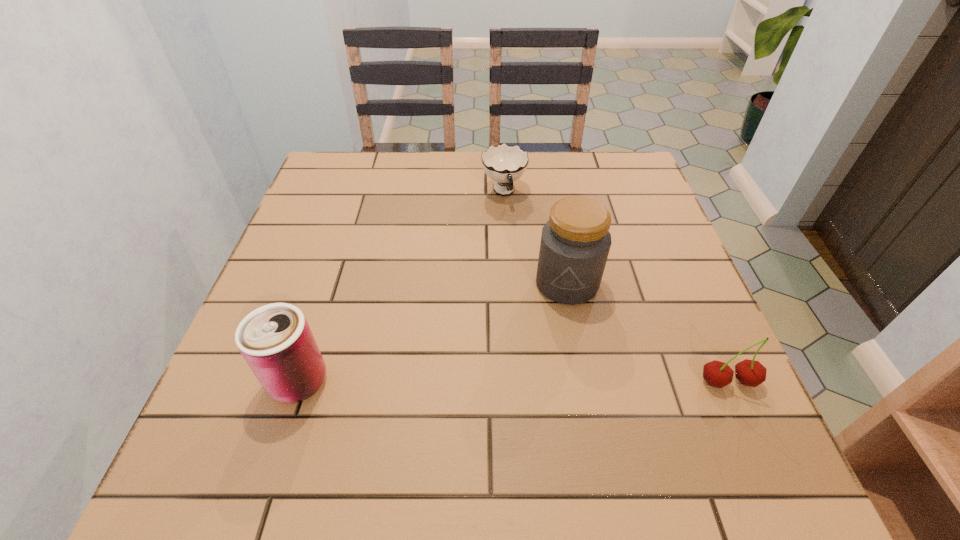
The width and height of the screenshot is (960, 540). Identify the location of free space located 0.060m on the surface of the jar near the warning symbol. (553, 327).

Locate an element on the screen. The width and height of the screenshot is (960, 540). vacant region located 0.190m on the surface of the jar near the warning symbol is located at coordinates (537, 381).

At what (x,y) coordinates should I click in order to perform the action: click on free space located on the side of the shortest object with the handle. Please return your answer as a coordinate pair (x, y). Looking at the image, I should click on (524, 256).

Where is `vacant space located 0.090m on the side of the shortest object with the handle`? vacant space located 0.090m on the side of the shortest object with the handle is located at coordinates (516, 232).

At what (x,y) coordinates should I click in order to perform the action: click on free space located 0.160m on the side of the shortest object with the handle. Please return your answer as a coordinate pair (x, y). The width and height of the screenshot is (960, 540). Looking at the image, I should click on (522, 251).

The height and width of the screenshot is (540, 960). Find the location of `object positioned at the far edge`. object positioned at the far edge is located at coordinates (504, 164).

The image size is (960, 540). I want to click on can at the near edge, so click(x=275, y=340).

This screenshot has height=540, width=960. What are the coordinates of `cherry present at the near edge` in the screenshot? It's located at (752, 373).

I want to click on object that is positioned at the left edge, so click(275, 340).

The width and height of the screenshot is (960, 540). Find the location of `object at the right edge`. object at the right edge is located at coordinates (752, 373).